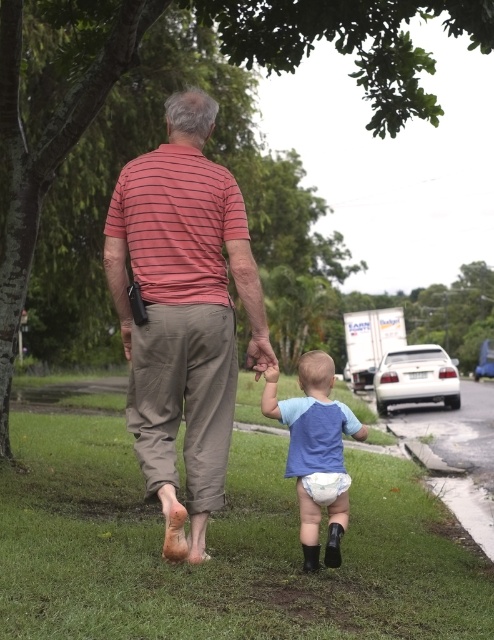
You are a photographer planning to take a picture of the scene. You want to ensure that both the green grass at lower center and the striped cotton shirt at center are clearly visible in the frame. Considering their sizes, which object should you focus on to ensure they are both in focus?

The green grass at lower center has a larger size compared to the striped cotton shirt at center. To ensure both are in focus, focus on the striped cotton shirt at center since it is smaller and closer to the camera, allowing the larger green grass at lower center to remain within the depth of field.

You are a photographer trying to capture a candid shot of the two individuals. Since you want to focus on the striped cotton shirt at center and the blue fabric diaper at lower center, which object should you adjust your camera focus to first based on their positions?

The striped cotton shirt at center is located above the blue fabric diaper at lower center, so you should focus on the striped cotton shirt at center first as it is higher in the frame.

You are a delivery robot that needs to deliver a package to the older individual walking beside the green grass at lower center. The robot is 1.5 meters tall. Can the robot see the older individual from its current position?

The green grass at lower center and viewer are 3.12 meters apart from each other. Since the robot is 1.5 meters tall, it can see the older individual as the distance between them is within a reasonable line of sight.